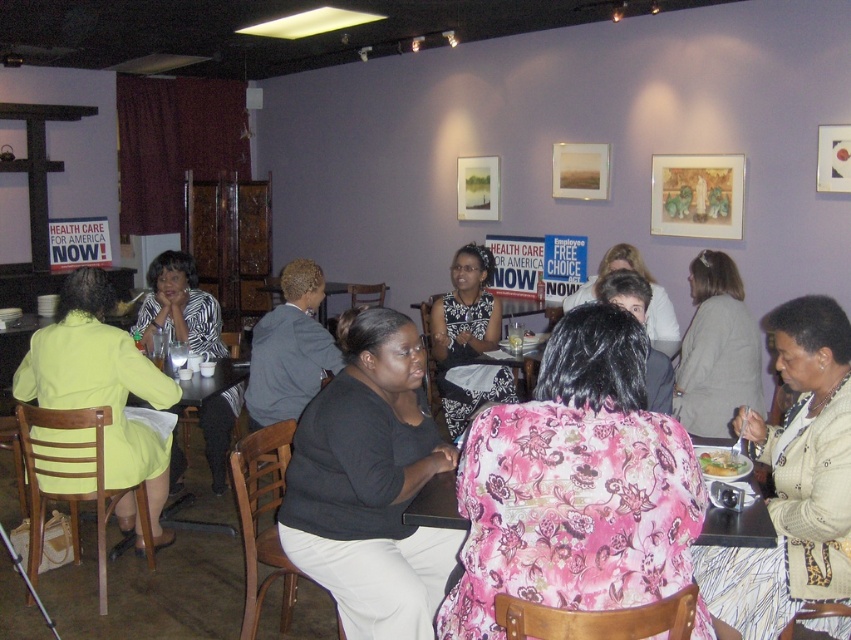
Measure the distance between black and white dress at center and camera.

The distance of black and white dress at center from camera is 4.13 meters.

Who is positioned more to the right, black and white dress at center or floral print blouse at center?

floral print blouse at center

Which is in front, point (433, 346) or point (637, 268)?

Point (433, 346) is in front.

I want to click on black and white dress at center, so click(x=467, y=339).

Between black matte shirt at center and floral print blouse at center, which one is positioned lower?

black matte shirt at center is below.

Is black matte shirt at center bigger than floral print blouse at center?

Actually, black matte shirt at center might be smaller than floral print blouse at center.

Who is more forward, (x=444, y=460) or (x=663, y=317)?

Point (x=444, y=460) is more forward.

Where is `black matte shirt at center`? This screenshot has height=640, width=851. black matte shirt at center is located at coordinates (369, 486).

Is light beige sweater at lower right positioned at the back of zebra print blouse at center?

No.

Between light beige sweater at lower right and zebra print blouse at center, which one is positioned higher?

zebra print blouse at center

What do you see at coordinates (792, 481) in the screenshot?
I see `light beige sweater at lower right` at bounding box center [792, 481].

Image resolution: width=851 pixels, height=640 pixels. I want to click on light beige sweater at lower right, so click(792, 481).